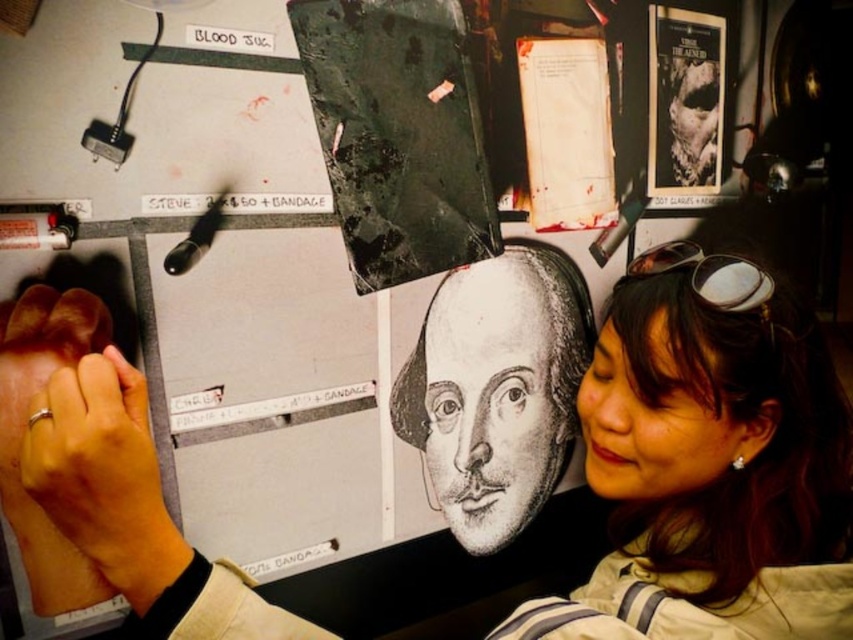
You are an artist trying to hang a new poster on the wall. The poster is 1.2 meters tall. Looking at the matte black face at center and the white paper at upper right, which object is taller and can the poster fit above the taller one without overlapping?

The matte black face at center is taller than the white paper at upper right. Since the poster is 1.2 meters tall and the matte black face at center is the taller object, you need to ensure there is enough vertical space above it to accommodate the poster without overlapping. However, the exact height of the matte black face at center isn

You are an artist trying to locate your black paper at center and hardcover book at upper right. Based on the scene description, which object is positioned to the left of the other?

The black paper at center is to the left of the hardcover book at upper right.

You are an artist trying to hang a new poster on the wall. The poster is as tall as the smooth skin face at lower right. Will it fit vertically above the matte black face at center without overlapping?

The matte black face at center is much taller than the smooth skin face at lower right. Since the poster is as tall as the smooth skin face at lower right, it will fit vertically above the matte black face at center without overlapping because there is enough space above the taller matte black face at center.